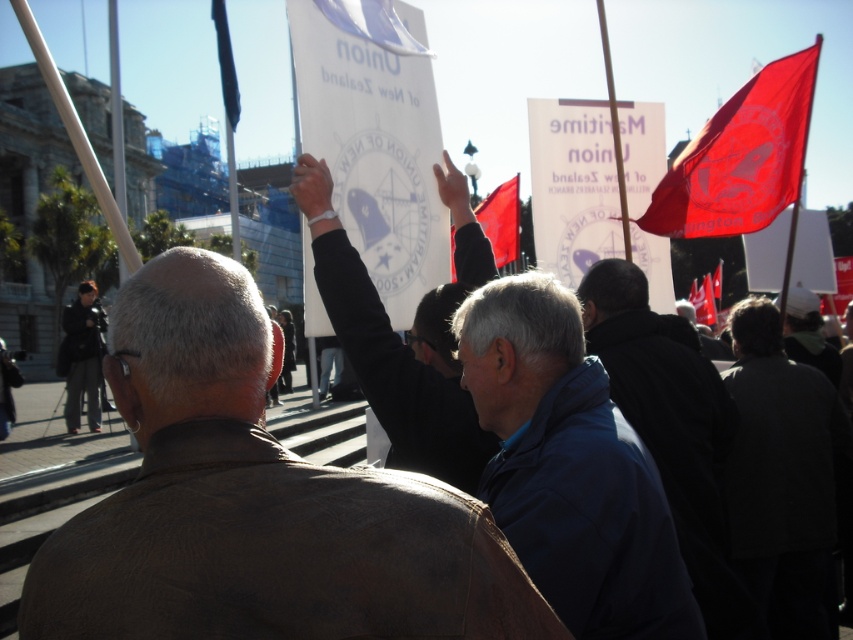
Question: Is dark gray jacket at lower right thinner than blue fabric flag at upper left?

Choices:
 (A) no
 (B) yes

Answer: (B)

Question: Among these points, which one is nearest to the camera?

Choices:
 (A) (502, 262)
 (B) (672, 458)
 (C) (766, 122)
 (D) (776, 474)

Answer: (B)

Question: Considering the relative positions of black fabric shirt at center and blue fabric flag at upper left in the image provided, where is black fabric shirt at center located with respect to blue fabric flag at upper left?

Choices:
 (A) right
 (B) left

Answer: (A)

Question: Can you confirm if blue fabric jacket at center is wider than dark gray jacket at lower right?

Choices:
 (A) no
 (B) yes

Answer: (A)

Question: Estimate the real-world distances between objects in this image. Which object is farther from the blue fabric jacket at center?

Choices:
 (A) brown corduroy jacket at center
 (B) black fabric shirt at center

Answer: (A)

Question: Which object is farther from the camera taking this photo?

Choices:
 (A) red fabric flag at upper right
 (B) dark blue jacket at center
 (C) blue fabric jacket at center
 (D) red fabric flag at center

Answer: (D)